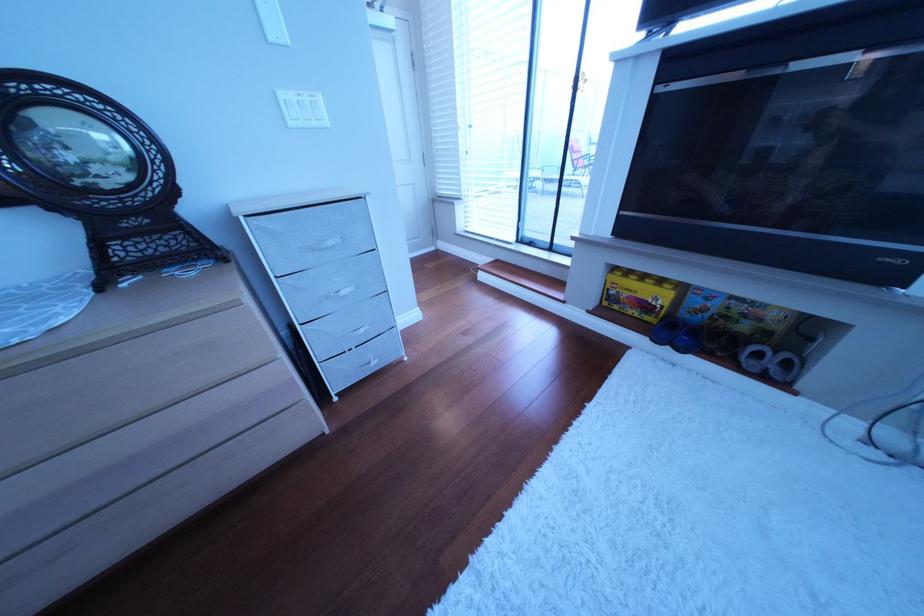
Image resolution: width=924 pixels, height=616 pixels. What do you see at coordinates (301, 108) in the screenshot? I see `a light switch rocker` at bounding box center [301, 108].